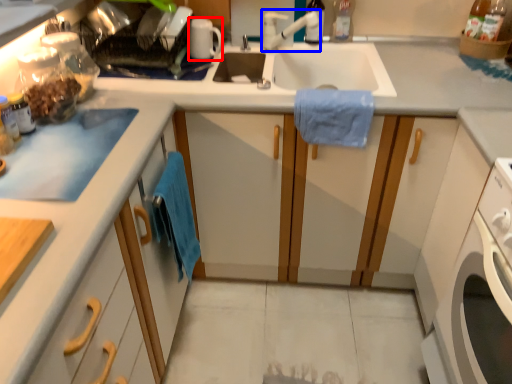
Question: Among these objects, which one is nearest to the camera, appliance (highlighted by a red box) or faucet (highlighted by a blue box)?

Choices:
 (A) appliance
 (B) faucet

Answer: (B)